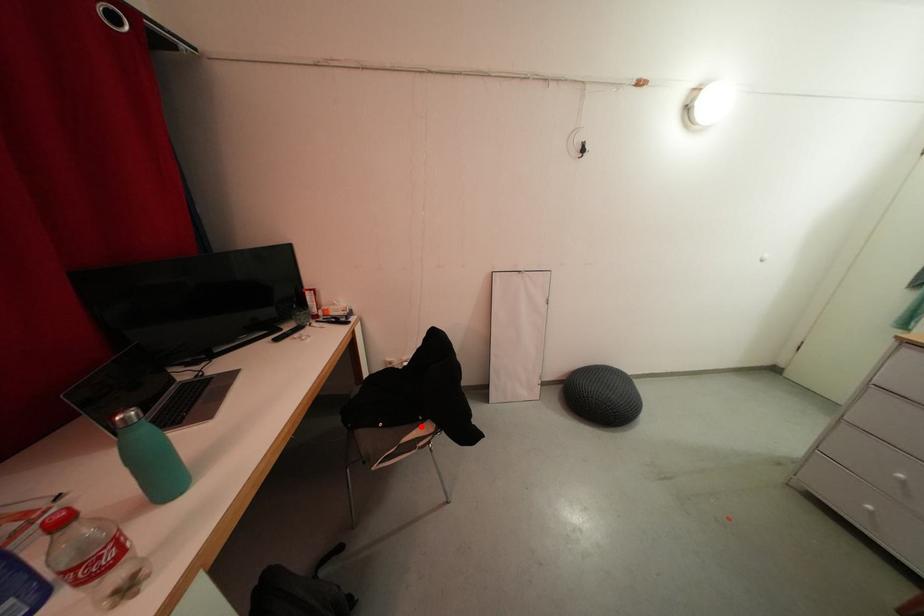
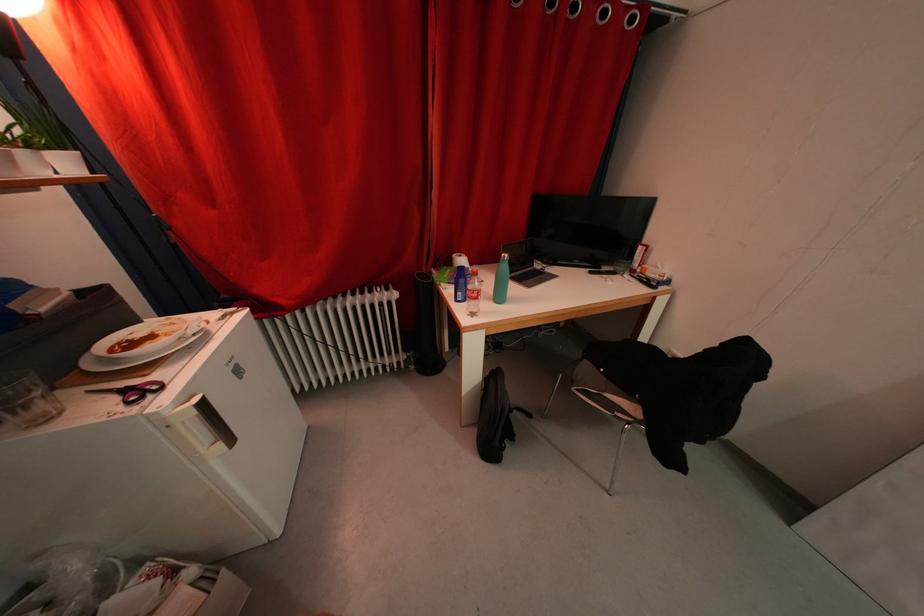
Question: I am providing you with two images of the same scene from different viewpoints. In image1, a red point is highlighted. Considering the same 3D point in image2, which of the following is correct?

Choices:
 (A) It is closer
 (B) It is farther

Answer: (A)